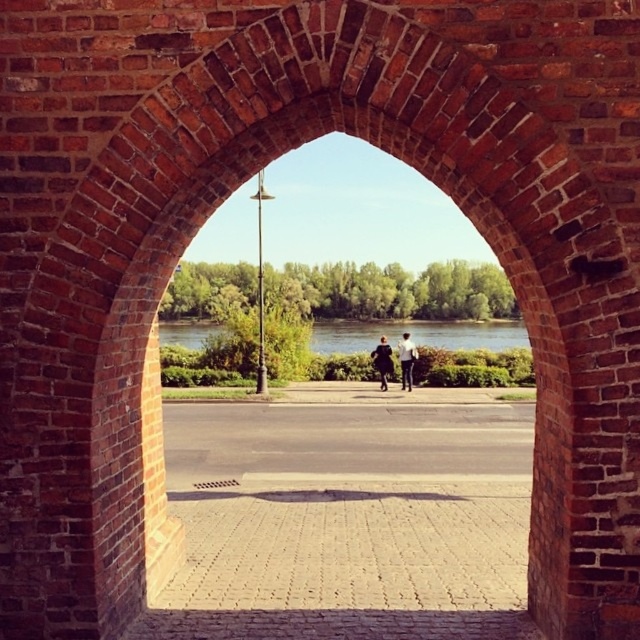
You are standing in front of the brick archway and see a dark gray fabric coat at center. Where is the point at coordinate [406,360] located?

The point at coordinate [406,360] is located on the dark gray fabric coat at center.

You are standing in front of the brick archway and notice two points marked on the ground. One is at coordinates point (404, 348) and the other at point (404, 353). If you were to walk towards the pathway leading to the water, which point would you step on first?

Point (404, 353) would be stepped on first because it is in front of point (404, 348) according to the spatial description provided.

You are standing in front of the brick archway and notice a dark gray fabric coat at center and light blue jeans at center. Which item is closer to you?

The dark gray fabric coat at center is closer to you since it is further to the viewer than the light blue jeans at center.